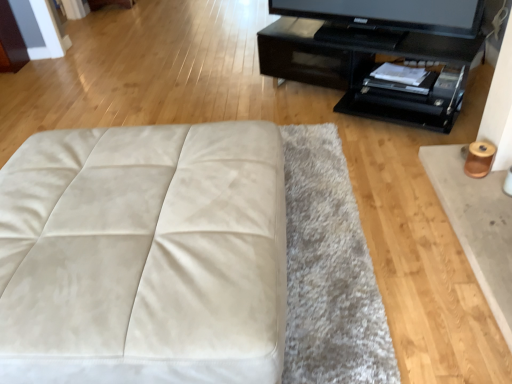
Question: In the image, is black glossy tv stand at upper right on the left side or the right side of matte black television at upper right?

Choices:
 (A) left
 (B) right

Answer: (A)

Question: From the image's perspective, is black glossy tv stand at upper right located above or below matte black television at upper right?

Choices:
 (A) above
 (B) below

Answer: (B)

Question: Estimate the real-world distances between objects in this image. Which object is closer to the matte black television at upper right?

Choices:
 (A) white suede ottoman at center
 (B) black glossy tv stand at upper right

Answer: (B)

Question: Which object is the closest to the matte black television at upper right?

Choices:
 (A) black glossy tv stand at upper right
 (B) white suede ottoman at center

Answer: (A)